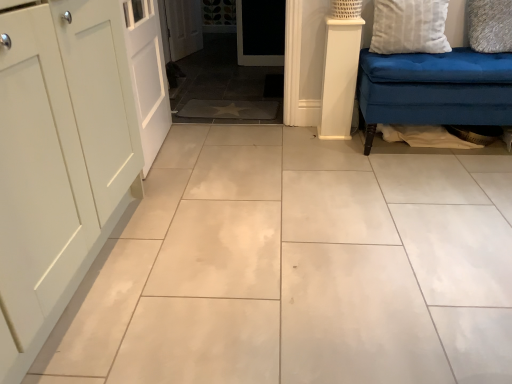
Question: Is white textured pillow at upper right, which ranks as the second pillow in left-to-right order, next to white smooth column at right?

Choices:
 (A) no
 (B) yes

Answer: (A)

Question: Is white textured pillow at upper right, which ranks as the second pillow in left-to-right order, far away from white smooth column at right?

Choices:
 (A) no
 (B) yes

Answer: (A)

Question: Is white textured pillow at upper right, positioned as the 1th pillow in right-to-left order, taller than white smooth column at right?

Choices:
 (A) yes
 (B) no

Answer: (B)

Question: Is white textured pillow at upper right, which ranks as the second pillow in left-to-right order, thinner than white smooth column at right?

Choices:
 (A) no
 (B) yes

Answer: (B)

Question: Considering the relative sizes of white textured pillow at upper right, positioned as the 1th pillow in right-to-left order, and white smooth column at right in the image provided, is white textured pillow at upper right, positioned as the 1th pillow in right-to-left order, smaller than white smooth column at right?

Choices:
 (A) no
 (B) yes

Answer: (B)

Question: Is white textured pillow at upper right, positioned as the 1th pillow in right-to-left order, in front of white smooth column at right?

Choices:
 (A) yes
 (B) no

Answer: (A)

Question: From the image's perspective, does white textured pillow at upper right, arranged as the 2th pillow when viewed from the right, appear higher than white textured pillow at upper right, positioned as the 1th pillow in right-to-left order?

Choices:
 (A) yes
 (B) no

Answer: (B)

Question: Is white textured pillow at upper right, positioned as the 1th pillow in right-to-left order, completely or partially inside white textured pillow at upper right, arranged as the 2th pillow when viewed from the right?

Choices:
 (A) no
 (B) yes

Answer: (A)

Question: Does white textured pillow at upper right, the 1th pillow positioned from the left, touch white textured pillow at upper right, positioned as the 1th pillow in right-to-left order?

Choices:
 (A) yes
 (B) no

Answer: (B)

Question: From a real-world perspective, is white textured pillow at upper right, arranged as the 2th pillow when viewed from the right, positioned under white textured pillow at upper right, which ranks as the second pillow in left-to-right order, based on gravity?

Choices:
 (A) no
 (B) yes

Answer: (A)

Question: Is white textured pillow at upper right, the 1th pillow positioned from the left, shorter than white textured pillow at upper right, positioned as the 1th pillow in right-to-left order?

Choices:
 (A) yes
 (B) no

Answer: (B)

Question: Does white textured pillow at upper right, the 1th pillow positioned from the left, appear on the right side of white textured pillow at upper right, positioned as the 1th pillow in right-to-left order?

Choices:
 (A) yes
 (B) no

Answer: (B)

Question: Does white textured pillow at upper right, arranged as the 2th pillow when viewed from the right, turn towards white smooth column at right?

Choices:
 (A) no
 (B) yes

Answer: (A)